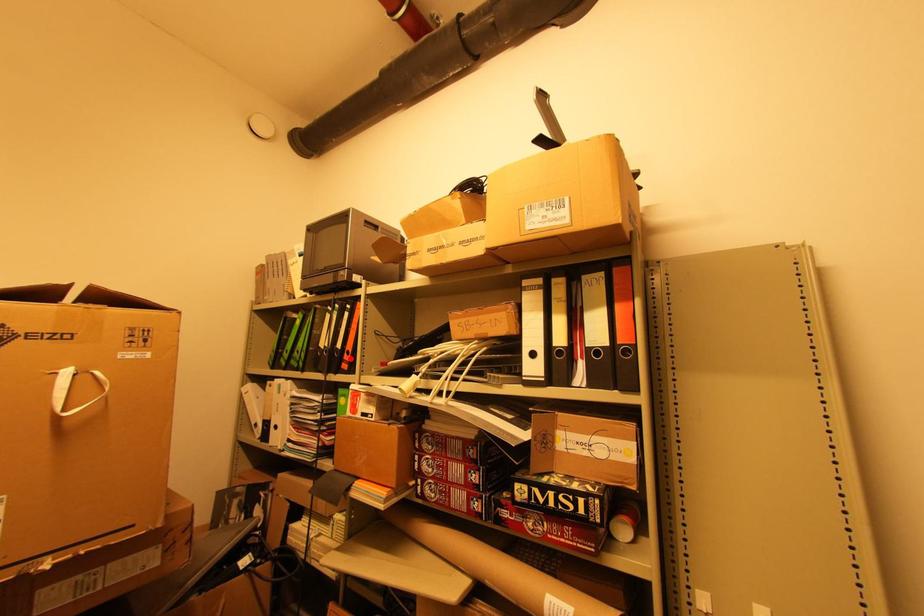
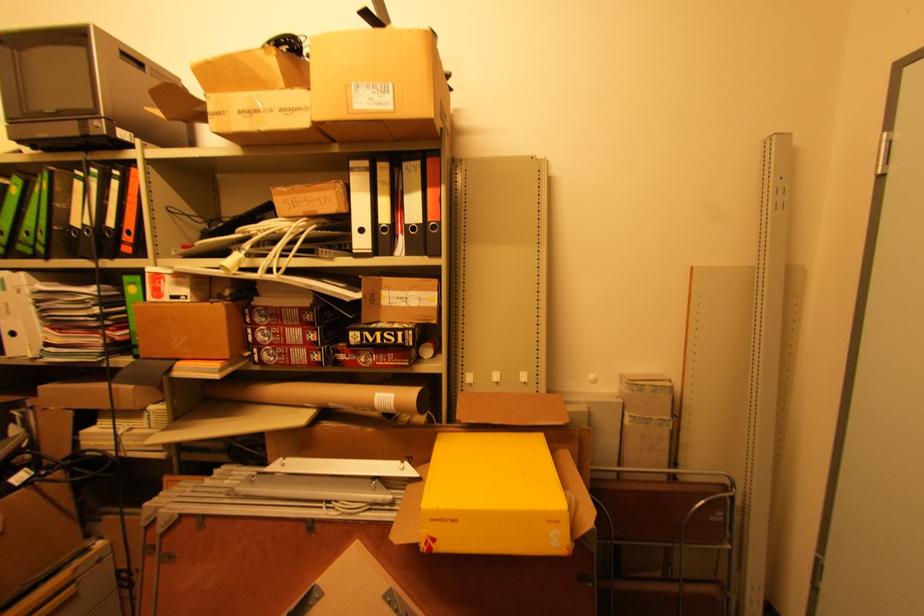
Locate, in the second image, the point that corresponds to the highlighted location in the first image.

(131, 238)